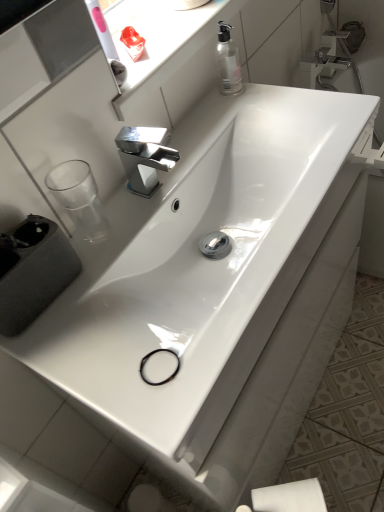
This screenshot has width=384, height=512. I want to click on free point above white glossy sink at center, which is the second sink from back to front (from a real-world perspective), so click(165, 211).